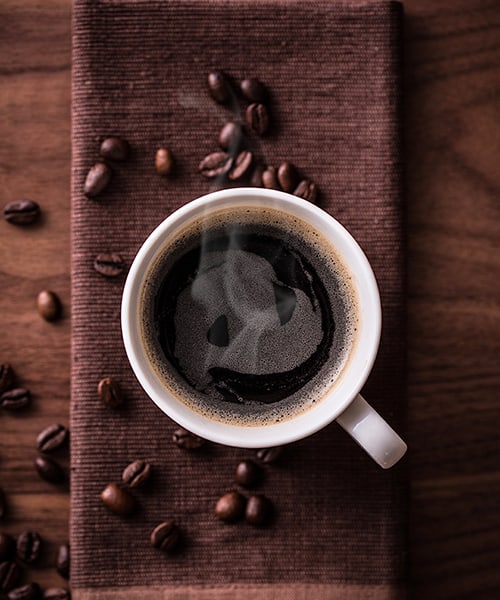
What are the coordinates of `swirly froth in middle of coffee` in the screenshot? It's located at (266, 331).